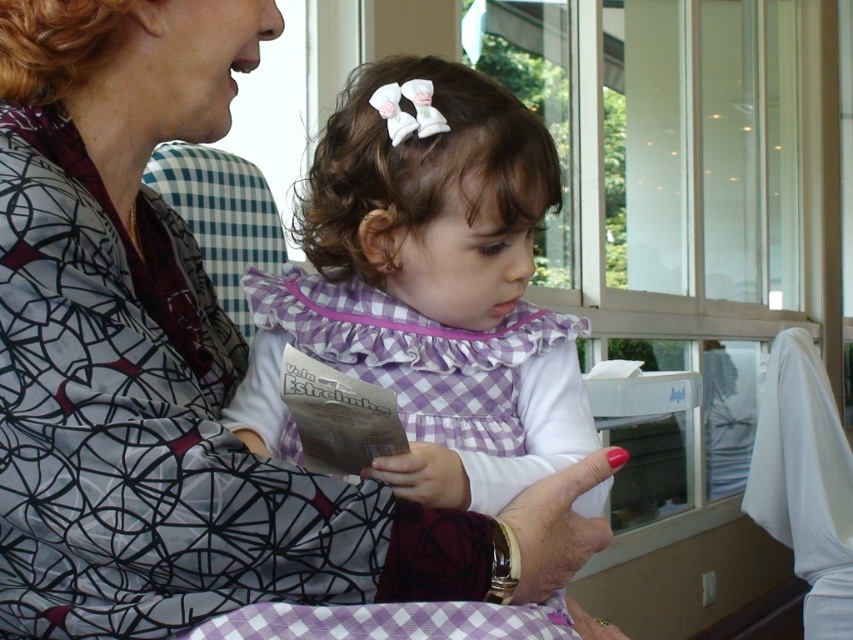
Measure the distance between matte black blouse at center and purple checkered dress at center.

matte black blouse at center and purple checkered dress at center are 13.79 centimeters apart from each other.

Between matte black blouse at center and purple checkered dress at center, which one is positioned higher?

purple checkered dress at center is higher up.

What are the coordinates of `matte black blouse at center` in the screenshot? It's located at (154, 356).